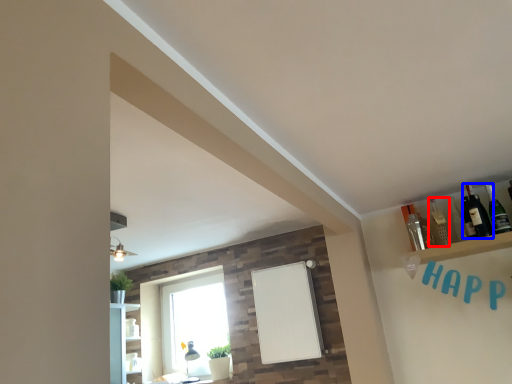
Question: Which object appears closest to the camera in this image, bottle (highlighted by a red box) or bottle (highlighted by a blue box)?

Choices:
 (A) bottle
 (B) bottle

Answer: (B)